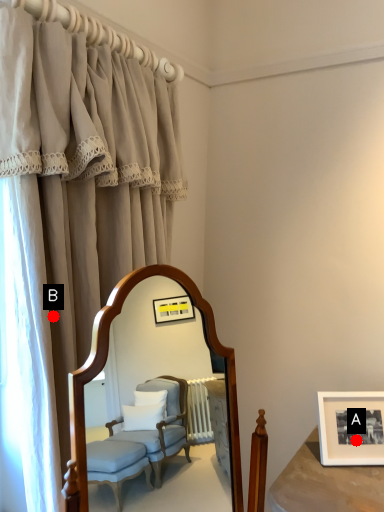
Question: Two points are circled on the image, labeled by A and B beside each circle. Which point is further to the camera?

Choices:
 (A) A is further
 (B) B is further

Answer: (A)